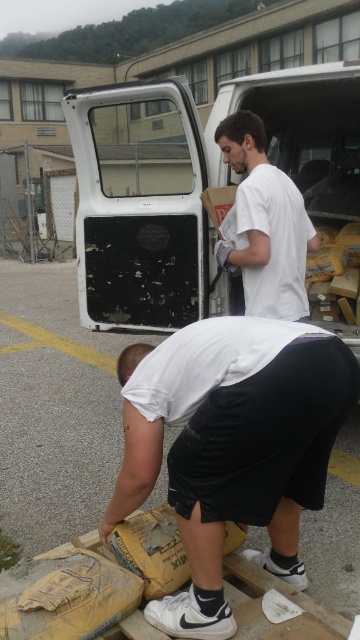
Question: Which point is closer to the camera?

Choices:
 (A) white matte truck door at upper center
 (B) white matte shorts at lower center
 (C) white matte shirt at center

Answer: (B)

Question: Does white matte shorts at lower center appear on the right side of white matte shirt at center?

Choices:
 (A) yes
 (B) no

Answer: (B)

Question: Which object is closer to the camera taking this photo?

Choices:
 (A) white matte shorts at lower center
 (B) white matte truck door at upper center
 (C) white matte shirt at center

Answer: (A)

Question: Is white matte truck door at upper center further to camera compared to white matte shorts at lower center?

Choices:
 (A) no
 (B) yes

Answer: (B)

Question: Which is farther from the white matte shorts at lower center?

Choices:
 (A) white matte truck door at upper center
 (B) white matte shirt at center

Answer: (A)

Question: Can you confirm if white matte truck door at upper center is thinner than white matte shirt at center?

Choices:
 (A) no
 (B) yes

Answer: (A)